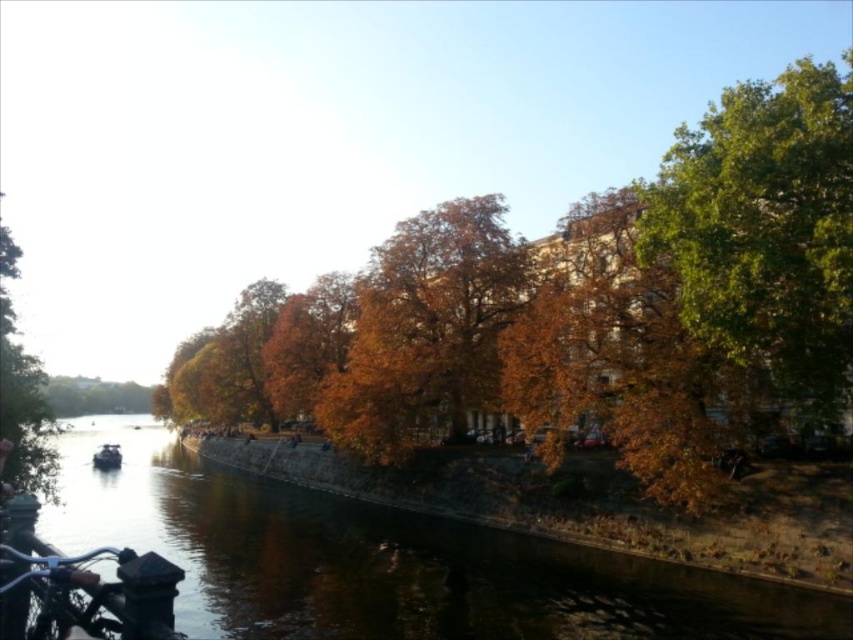
You are standing at the stone embankment in the riverside scene and see two points marked on the image. Which point, point (711,451) or point (39,484), is closer to you?

Point (711,451) is further to the viewer than point (39,484), so the closer point to you is point (39,484).

You are standing at the riverside and see a point marked at coordinates (582, 310). What object is located at that point?

The point at (582, 310) corresponds to the orange leafy tree at center.

You are an artist planning to paint the riverside scene. You want to ensure the green leafy tree at right and the matte black boat at lower left are proportionally accurate. Which object should you draw larger in your painting?

The green leafy tree at right should be drawn larger than the matte black boat at lower left since it is bigger according to the description.